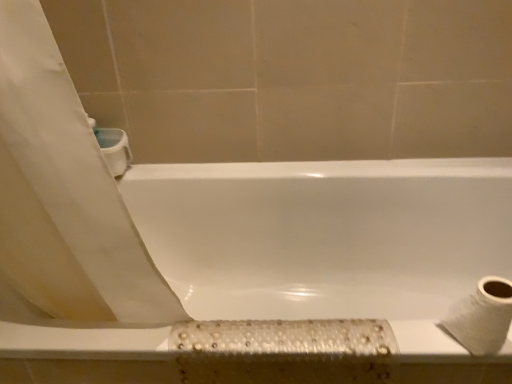
Question: Is white textured toilet paper at lower right oriented away from white glossy bathtub at center?

Choices:
 (A) no
 (B) yes

Answer: (A)

Question: From a real-world perspective, does white textured toilet paper at lower right sit lower than white glossy bathtub at center?

Choices:
 (A) no
 (B) yes

Answer: (A)

Question: Considering the relative positions of white textured toilet paper at lower right and white glossy bathtub at center in the image provided, is white textured toilet paper at lower right in front of white glossy bathtub at center?

Choices:
 (A) yes
 (B) no

Answer: (A)

Question: From the image's perspective, is white textured toilet paper at lower right below white glossy bathtub at center?

Choices:
 (A) yes
 (B) no

Answer: (B)

Question: Can you confirm if white textured toilet paper at lower right is bigger than white glossy bathtub at center?

Choices:
 (A) no
 (B) yes

Answer: (A)

Question: Is white textured toilet paper at lower right to the right of white glossy bathtub at center from the viewer's perspective?

Choices:
 (A) yes
 (B) no

Answer: (A)

Question: Can you confirm if white glossy bathtub at center is wider than white textured toilet paper at lower right?

Choices:
 (A) no
 (B) yes

Answer: (B)

Question: Considering the relative sizes of white glossy bathtub at center and white textured toilet paper at lower right in the image provided, is white glossy bathtub at center bigger than white textured toilet paper at lower right?

Choices:
 (A) yes
 (B) no

Answer: (A)

Question: From a real-world perspective, is white glossy bathtub at center positioned under white textured toilet paper at lower right based on gravity?

Choices:
 (A) no
 (B) yes

Answer: (B)

Question: Does white glossy bathtub at center appear on the left side of white textured toilet paper at lower right?

Choices:
 (A) yes
 (B) no

Answer: (A)

Question: Could you tell me if white glossy bathtub at center is turned towards white textured toilet paper at lower right?

Choices:
 (A) yes
 (B) no

Answer: (B)

Question: Is the surface of white glossy bathtub at center in direct contact with white textured toilet paper at lower right?

Choices:
 (A) no
 (B) yes

Answer: (A)

Question: Is white glossy bathtub at center bigger or smaller than white textured toilet paper at lower right?

Choices:
 (A) small
 (B) big

Answer: (B)